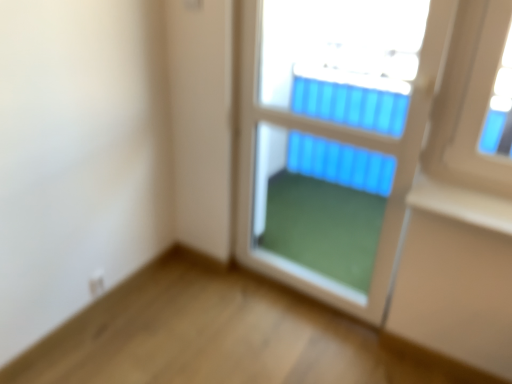
What do you see at coordinates (333, 138) in the screenshot?
I see `transparent glass window at center` at bounding box center [333, 138].

Measure the distance between point [415,14] and camera.

Point [415,14] is 9.04 feet away from camera.

Image resolution: width=512 pixels, height=384 pixels. Find the location of `transparent glass window at center`. transparent glass window at center is located at coordinates (333, 138).

Find the location of a particular element. transparent glass window at center is located at coordinates (333, 138).